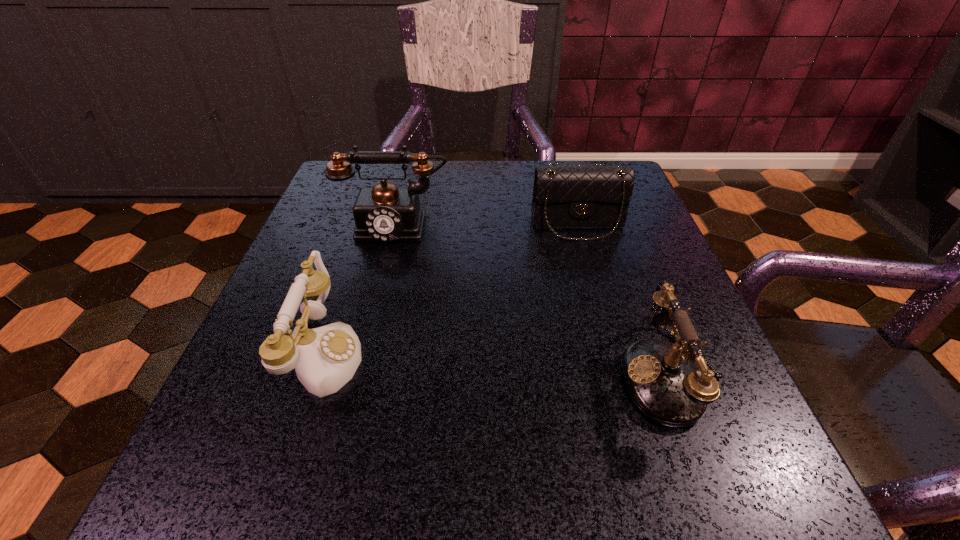
Where is `blank region between the tallest object and the rightmost telephone`? This screenshot has height=540, width=960. blank region between the tallest object and the rightmost telephone is located at coordinates (533, 301).

This screenshot has height=540, width=960. I want to click on object that can be found as the second closest to the rightmost telephone, so click(x=384, y=213).

The image size is (960, 540). Identify the location of object that can be found as the third closest to the rightmost telephone. (325, 358).

This screenshot has height=540, width=960. Identify the location of telephone identified as the closest to the rightmost telephone. (384, 213).

You are a GUI agent. You are given a task and a screenshot of the screen. Output one action in this format:
    pyautogui.click(x=<x>, y=<y>)
    Task: Click on the telephone that stands as the closest to the rightmost telephone
    This screenshot has height=540, width=960.
    Given the screenshot: What is the action you would take?
    pyautogui.click(x=384, y=213)